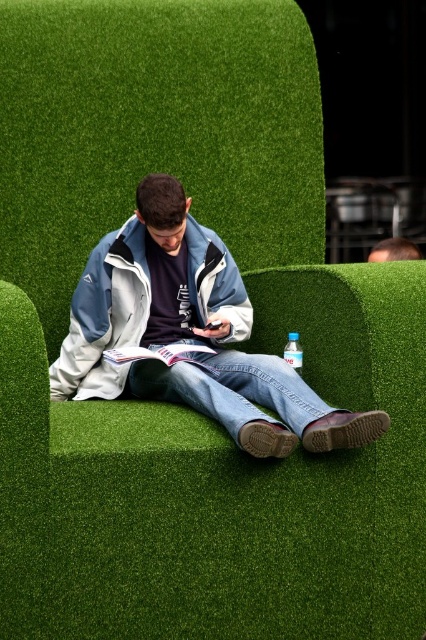
Question: Which of the following is the farthest from the observer?

Choices:
 (A) (152, 202)
 (B) (288, 346)

Answer: (B)

Question: Does light blue jacket at center have a greater width compared to smooth brown hair at upper right?

Choices:
 (A) no
 (B) yes

Answer: (B)

Question: Is light blue fleece jacket at center thinner than striped fabric book at center?

Choices:
 (A) yes
 (B) no

Answer: (A)

Question: Among these objects, which one is nearest to the camera?

Choices:
 (A) light blue fleece jacket at center
 (B) striped fabric book at center

Answer: (B)

Question: Which object appears farthest from the camera in this image?

Choices:
 (A) light blue jacket at center
 (B) smooth brown hair at upper right

Answer: (B)

Question: Is light blue fleece jacket at center below striped fabric book at center?

Choices:
 (A) no
 (B) yes

Answer: (A)